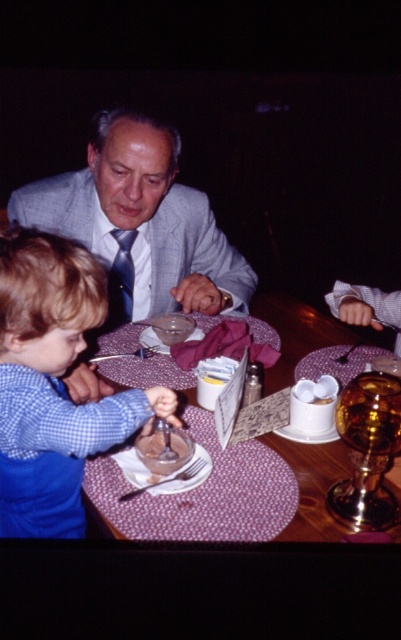
Looking at this image, between blue checkered shirt at lower left and wooden table at center, which one is positioned higher?

wooden table at center is higher up.

Can you confirm if blue checkered shirt at lower left is positioned to the left of wooden table at center?

Yes, blue checkered shirt at lower left is to the left of wooden table at center.

Is point (16, 467) positioned before point (342, 330)?

Yes.

You are a GUI agent. You are given a task and a screenshot of the screen. Output one action in this format:
    pyautogui.click(x=<x>, y=<y>)
    Task: Click on the blue checkered shirt at lower left
    Image resolution: width=401 pixels, height=640 pixels.
    Given the screenshot: What is the action you would take?
    pyautogui.click(x=54, y=385)

Does blue checkered shirt at lower left appear under smooth chocolate pudding at center?

Incorrect, blue checkered shirt at lower left is not positioned below smooth chocolate pudding at center.

Is point (0, 449) less distant than point (157, 442)?

Yes, point (0, 449) is closer to viewer.

Where is `blue checkered shirt at lower left`? The image size is (401, 640). blue checkered shirt at lower left is located at coordinates (54, 385).

Consider the image. Can you confirm if gray suit at center is taller than smooth chocolate pudding at center?

Yes.

Locate an element on the screen. This screenshot has height=640, width=401. gray suit at center is located at coordinates (141, 221).

The height and width of the screenshot is (640, 401). Describe the element at coordinates (141, 221) in the screenshot. I see `gray suit at center` at that location.

Image resolution: width=401 pixels, height=640 pixels. Find the location of `gray suit at center`. gray suit at center is located at coordinates pyautogui.click(x=141, y=221).